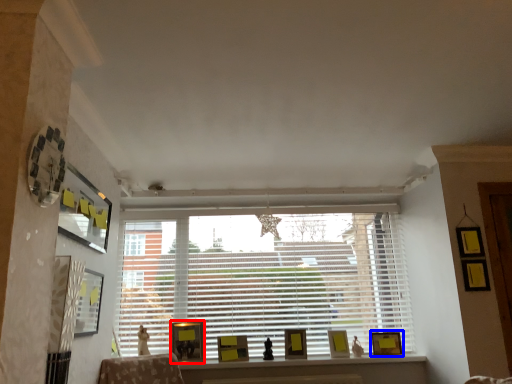
Question: Which object appears farthest to the camera in this image, picture frame (highlighted by a red box) or picture frame (highlighted by a blue box)?

Choices:
 (A) picture frame
 (B) picture frame

Answer: (B)